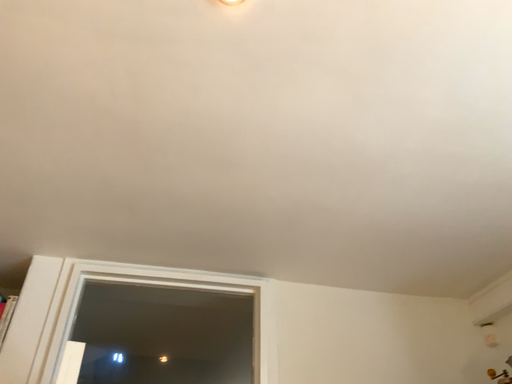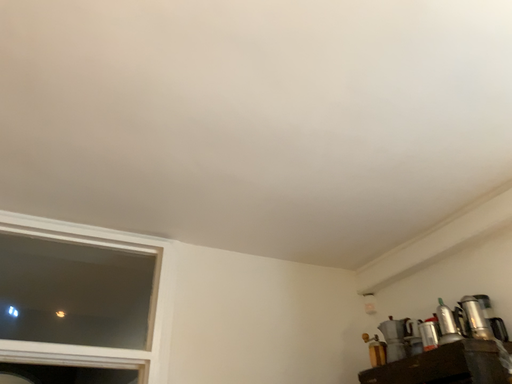
Question: Which way did the camera rotate in the video?

Choices:
 (A) rotated left
 (B) rotated right

Answer: (B)